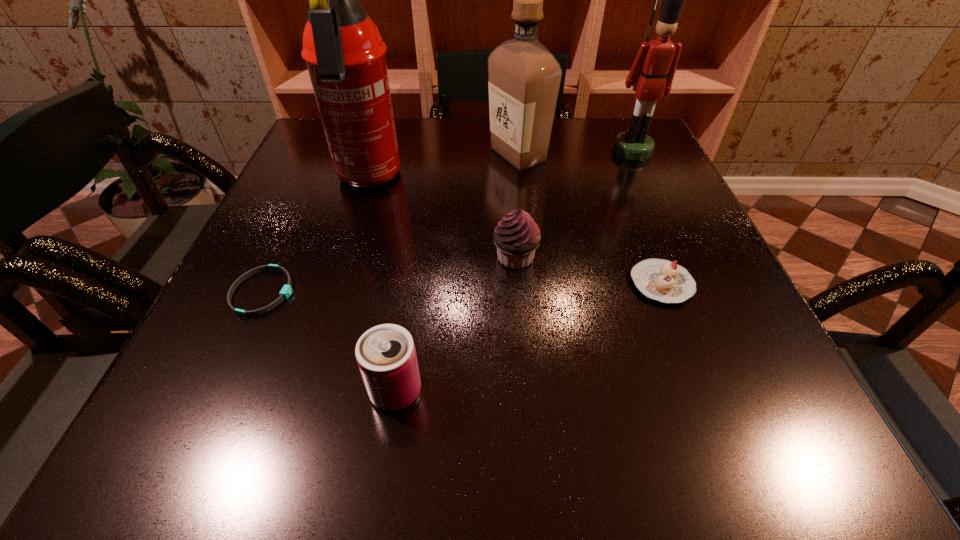
Identify the location of free space at the left edge of the desktop. The width and height of the screenshot is (960, 540). (226, 293).

Find the location of a particular element. The height and width of the screenshot is (540, 960). free space at the right edge of the desktop is located at coordinates (741, 384).

Locate an element on the screen. The width and height of the screenshot is (960, 540). vacant area at the far left corner of the desktop is located at coordinates (x=324, y=155).

In order to click on free spot at the near left corner of the desktop in this screenshot , I will do `click(177, 425)`.

I want to click on free space at the far right corner of the desktop, so click(604, 145).

You are a GUI agent. You are given a task and a screenshot of the screen. Output one action in this format:
    pyautogui.click(x=<x>, y=<y>)
    Task: Click on the free space between the liquor and the left cupcake
    Image resolution: width=960 pixels, height=540 pixels.
    Given the screenshot: What is the action you would take?
    pyautogui.click(x=516, y=206)

Find the location of a particular element. The width and height of the screenshot is (960, 540). empty space between the taller cupcake and the fire extinguisher is located at coordinates (x=442, y=218).

Image resolution: width=960 pixels, height=540 pixels. What are the coordinates of `empty location between the shortest object and the fire extinguisher` in the screenshot? It's located at (316, 236).

Where is `blank region between the taller cupcake and the second shortest object`? This screenshot has height=540, width=960. blank region between the taller cupcake and the second shortest object is located at coordinates (588, 271).

Find the location of a particular element. The height and width of the screenshot is (540, 960). free space between the shorter cupcake and the liquor is located at coordinates (590, 219).